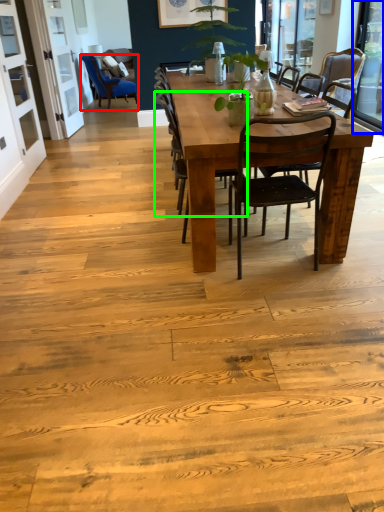
Question: Which is farther away from chair (highlighted by a red box)? window screen (highlighted by a blue box) or chair (highlighted by a green box)?

Choices:
 (A) window screen
 (B) chair

Answer: (B)